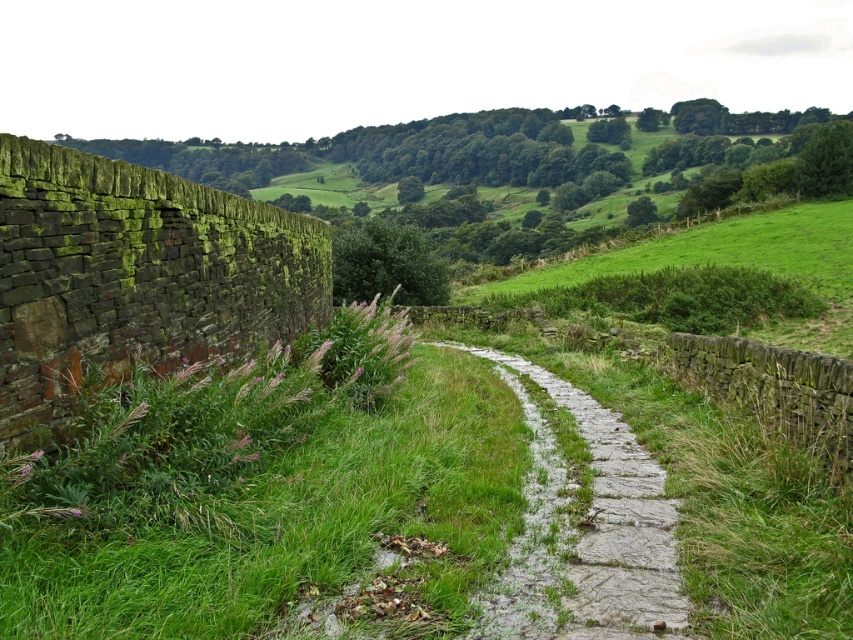
Question: Does green mossy stone wall at left have a larger size compared to gray stone path at center?

Choices:
 (A) no
 (B) yes

Answer: (B)

Question: Among these points, which one is nearest to the camera?

Choices:
 (A) (515, 602)
 (B) (270, 260)

Answer: (A)

Question: Which point appears farthest from the camera in this image?

Choices:
 (A) pos(280,269)
 (B) pos(624,444)

Answer: (A)

Question: From the image, what is the correct spatial relationship of green mossy stone wall at left in relation to gray stone path at center?

Choices:
 (A) left
 (B) right

Answer: (A)

Question: Can you confirm if green mossy stone wall at left is positioned above gray stone path at center?

Choices:
 (A) yes
 (B) no

Answer: (A)